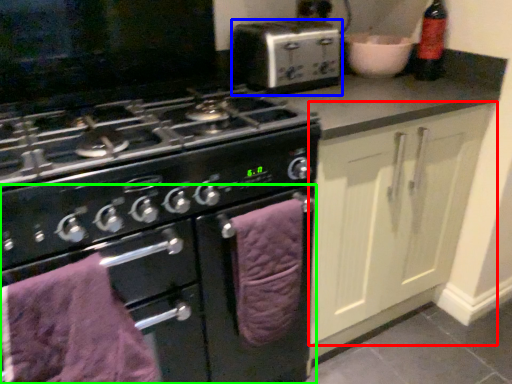
Question: Which object is positioned farthest from cabinetry (highlighted by a red box)? Select from kitchen appliance (highlighted by a blue box) and oven (highlighted by a green box).

Choices:
 (A) kitchen appliance
 (B) oven

Answer: (A)